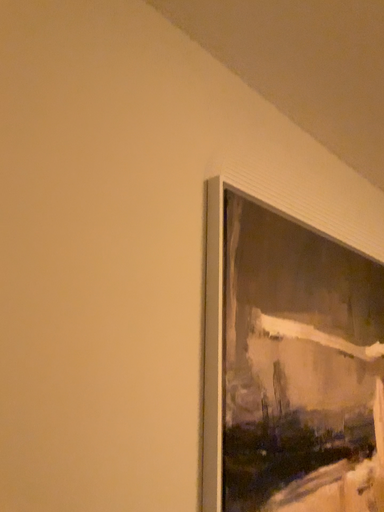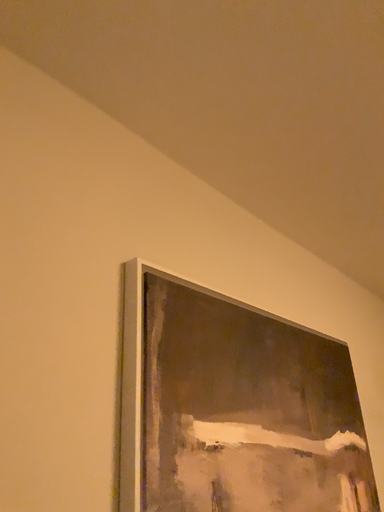
Question: Which way did the camera rotate in the video?

Choices:
 (A) rotated downward
 (B) rotated upward

Answer: (B)